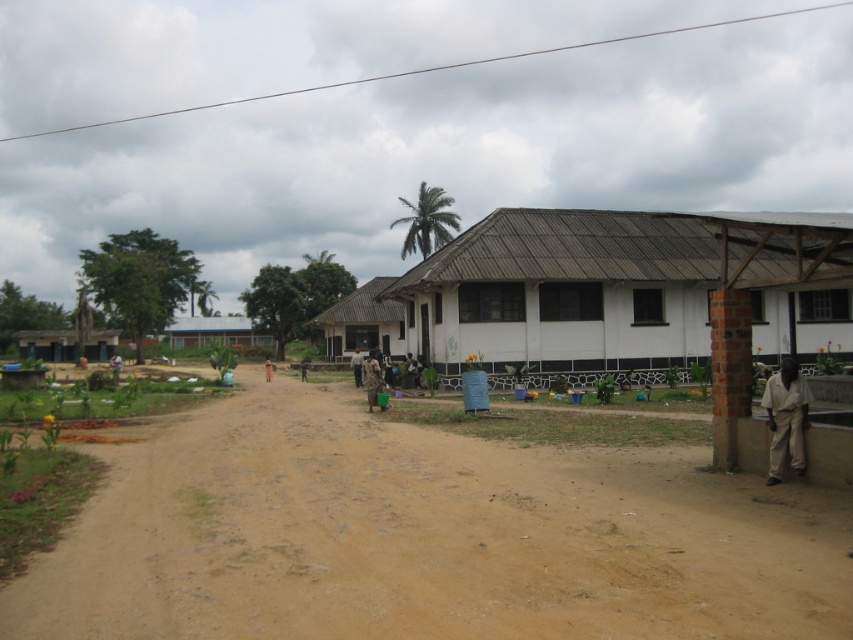
You are a photographer planning to take a picture of the brown dirt field at center and the brown fabric person at center. Based on their heights, which one should you focus on first to ensure proper framing?

The brown fabric person at center is taller than the brown dirt field at center, so you should focus on the brown fabric person at center first to ensure proper framing.

You are standing at the center of the dirt road in the rural scene. You need to locate the matte blue hut at left. According to the coordinates provided, in which direction should you move to find it?

The matte blue hut at left is located at coordinates point (65, 344), so you should move towards the left side of the dirt road to find it.